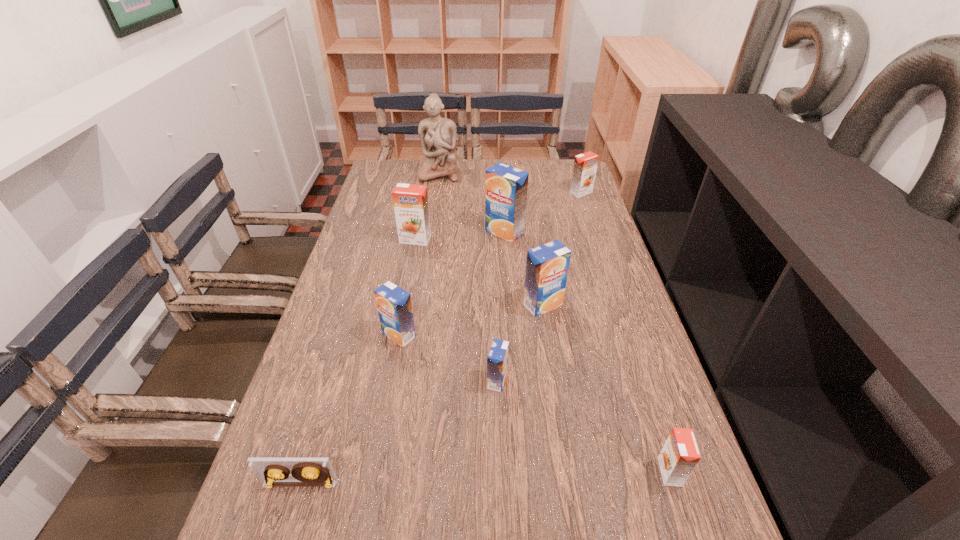
This screenshot has height=540, width=960. Identify the location of object located in the far right corner section of the desktop. (585, 165).

Locate an element on the screen. This screenshot has height=540, width=960. vacant space at the far edge of the desktop is located at coordinates pos(462,174).

Identify the location of vacant area at the left edge. click(345, 495).

The height and width of the screenshot is (540, 960). I want to click on vacant space at the right edge of the desktop, so click(606, 406).

Locate an element on the screen. This screenshot has height=540, width=960. free space between the biggest orange orange juice and the leftmost object is located at coordinates tap(358, 362).

Where is `vacant area that lies between the fourth nearest orange juice and the tallest object`? The height and width of the screenshot is (540, 960). vacant area that lies between the fourth nearest orange juice and the tallest object is located at coordinates (491, 239).

At what (x,y) coordinates should I click in order to perform the action: click on empty location between the second tallest object and the third smallest blue orange_juice. Please return your answer as a coordinate pair (x, y). This screenshot has height=540, width=960. Looking at the image, I should click on (524, 268).

This screenshot has height=540, width=960. In order to click on free space between the shortest object and the fourth nearest object in this screenshot , I will do `click(349, 410)`.

Locate an element on the screen. Image resolution: width=960 pixels, height=540 pixels. free space between the sixth farthest orange juice and the third nearest orange juice is located at coordinates (448, 358).

The image size is (960, 540). What are the coordinates of `vacant space that's between the nearest orange juice and the biggest blue orange_juice` in the screenshot? It's located at (588, 352).